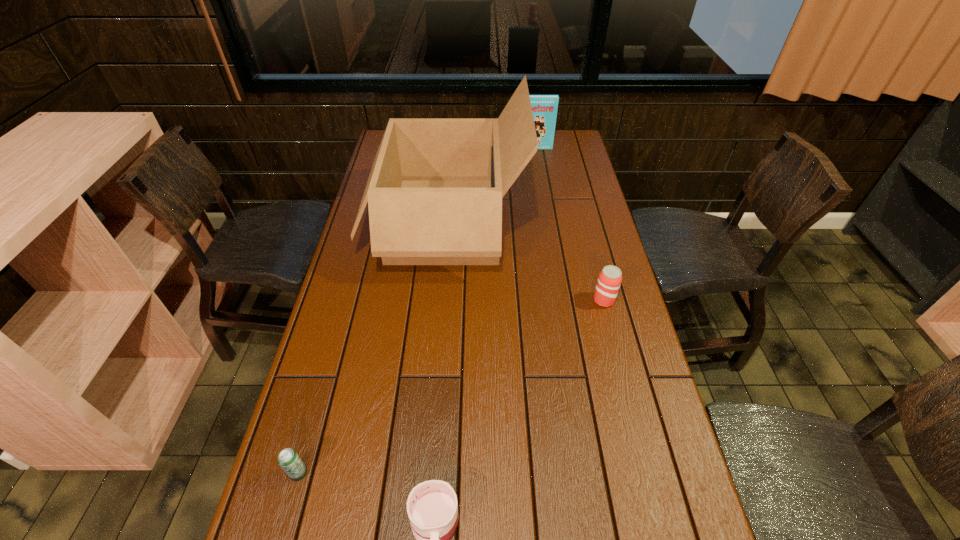
In order to click on empty space between the farther beer can and the box in this screenshot , I will do `click(525, 261)`.

This screenshot has width=960, height=540. Find the location of `empty location between the left beer can and the tallest object`. empty location between the left beer can and the tallest object is located at coordinates (372, 348).

Identify the location of empty location between the nearer beer can and the taller beer can. The height and width of the screenshot is (540, 960). (451, 387).

Identify the location of the closest object relative to the mug. This screenshot has height=540, width=960. (288, 459).

Find the location of `object that is the third nearest to the rightmost object`. object that is the third nearest to the rightmost object is located at coordinates (544, 107).